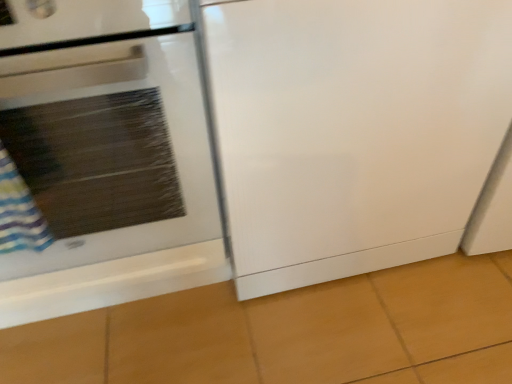
Question: Considering the relative sizes of white glossy oven at left and white glossy refrigerator at center in the image provided, is white glossy oven at left shorter than white glossy refrigerator at center?

Choices:
 (A) yes
 (B) no

Answer: (B)

Question: Is white glossy oven at left oriented away from white glossy refrigerator at center?

Choices:
 (A) yes
 (B) no

Answer: (B)

Question: Can we say white glossy oven at left lies outside white glossy refrigerator at center?

Choices:
 (A) no
 (B) yes

Answer: (B)

Question: Is white glossy oven at left bigger than white glossy refrigerator at center?

Choices:
 (A) no
 (B) yes

Answer: (B)

Question: Are white glossy oven at left and white glossy refrigerator at center located far from each other?

Choices:
 (A) yes
 (B) no

Answer: (B)

Question: From a real-world perspective, is white glossy oven at left on top of white glossy refrigerator at center?

Choices:
 (A) no
 (B) yes

Answer: (B)

Question: Is white glossy refrigerator at center not inside white glossy oven at left?

Choices:
 (A) no
 (B) yes

Answer: (B)

Question: Is white glossy refrigerator at center next to white glossy oven at left?

Choices:
 (A) no
 (B) yes

Answer: (A)

Question: From a real-world perspective, is white glossy refrigerator at center on top of white glossy oven at left?

Choices:
 (A) yes
 (B) no

Answer: (B)

Question: Does white glossy refrigerator at center lie behind white glossy oven at left?

Choices:
 (A) yes
 (B) no

Answer: (A)

Question: Is white glossy refrigerator at center far from white glossy oven at left?

Choices:
 (A) yes
 (B) no

Answer: (B)

Question: Does white glossy refrigerator at center have a larger size compared to white glossy oven at left?

Choices:
 (A) yes
 (B) no

Answer: (B)

Question: From a real-world perspective, relative to white glossy oven at left, is white glossy refrigerator at center vertically above or below?

Choices:
 (A) above
 (B) below

Answer: (B)